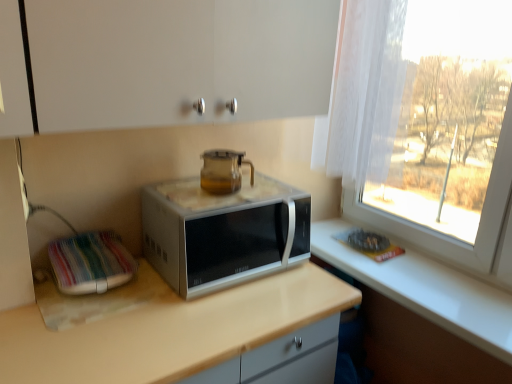
Question: From a real-world perspective, does satin silver microwave at center sit lower than beige laminate countertop at center?

Choices:
 (A) yes
 (B) no

Answer: (B)

Question: Considering the relative sizes of satin silver microwave at center and beige laminate countertop at center in the image provided, is satin silver microwave at center taller than beige laminate countertop at center?

Choices:
 (A) yes
 (B) no

Answer: (B)

Question: Could you tell me if satin silver microwave at center is facing beige laminate countertop at center?

Choices:
 (A) yes
 (B) no

Answer: (B)

Question: From the image's perspective, does satin silver microwave at center appear lower than beige laminate countertop at center?

Choices:
 (A) yes
 (B) no

Answer: (B)

Question: From the image's perspective, is satin silver microwave at center on top of beige laminate countertop at center?

Choices:
 (A) yes
 (B) no

Answer: (A)

Question: Can you confirm if satin silver microwave at center is bigger than beige laminate countertop at center?

Choices:
 (A) yes
 (B) no

Answer: (B)

Question: Is white fabric at left beside transparent glass teapot at center?

Choices:
 (A) yes
 (B) no

Answer: (B)

Question: Is white fabric at left shorter than transparent glass teapot at center?

Choices:
 (A) yes
 (B) no

Answer: (A)

Question: Is white fabric at left thinner than transparent glass teapot at center?

Choices:
 (A) yes
 (B) no

Answer: (B)

Question: Can transparent glass teapot at center be found inside white fabric at left?

Choices:
 (A) yes
 (B) no

Answer: (B)

Question: Does white fabric at left lie behind transparent glass teapot at center?

Choices:
 (A) no
 (B) yes

Answer: (A)

Question: From a real-world perspective, is white fabric at left over transparent glass teapot at center?

Choices:
 (A) no
 (B) yes

Answer: (A)

Question: Is white fabric at left with beige laminate countertop at center?

Choices:
 (A) yes
 (B) no

Answer: (B)